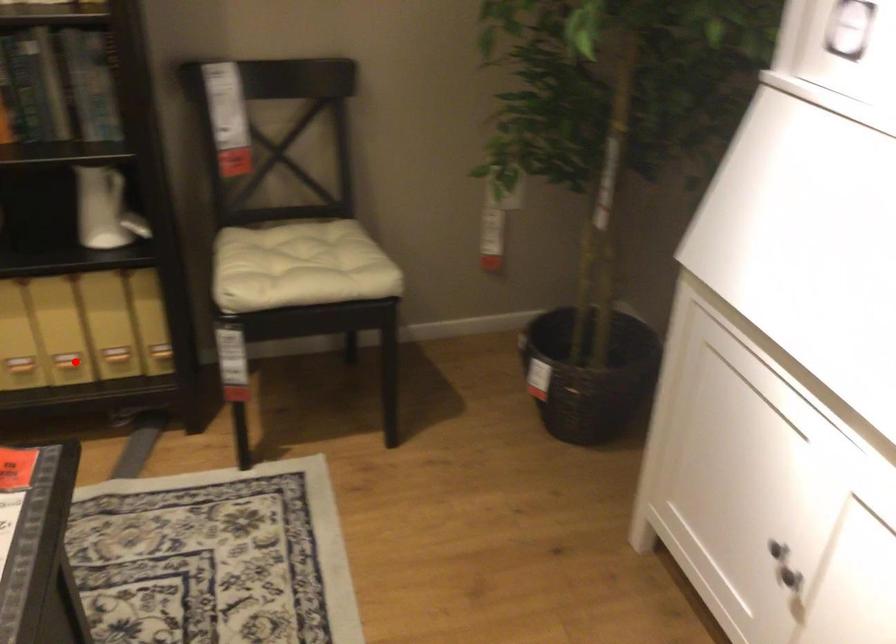
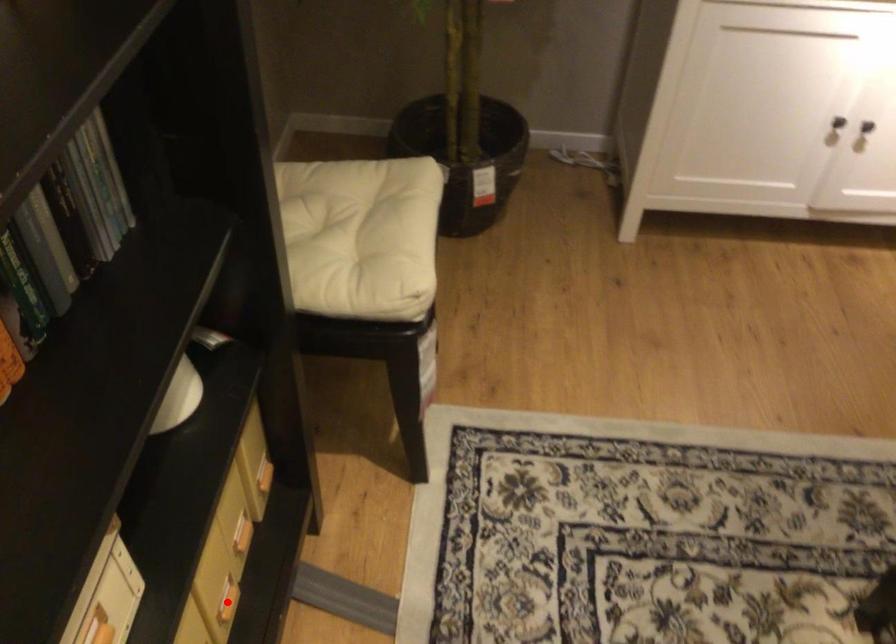
I am providing you with two images of the same scene from different viewpoints. A red point is marked on the first image and another point is marked on the second image. Is the marked point in image1 the same physical position as the marked point in image2?

Yes